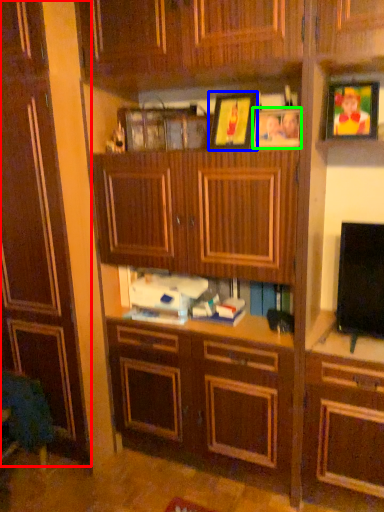
Question: Based on their relative distances, which object is farther from cabinetry (highlighted by a red box)? Choose from picture frame (highlighted by a blue box) and picture frame (highlighted by a green box).

Choices:
 (A) picture frame
 (B) picture frame

Answer: (B)